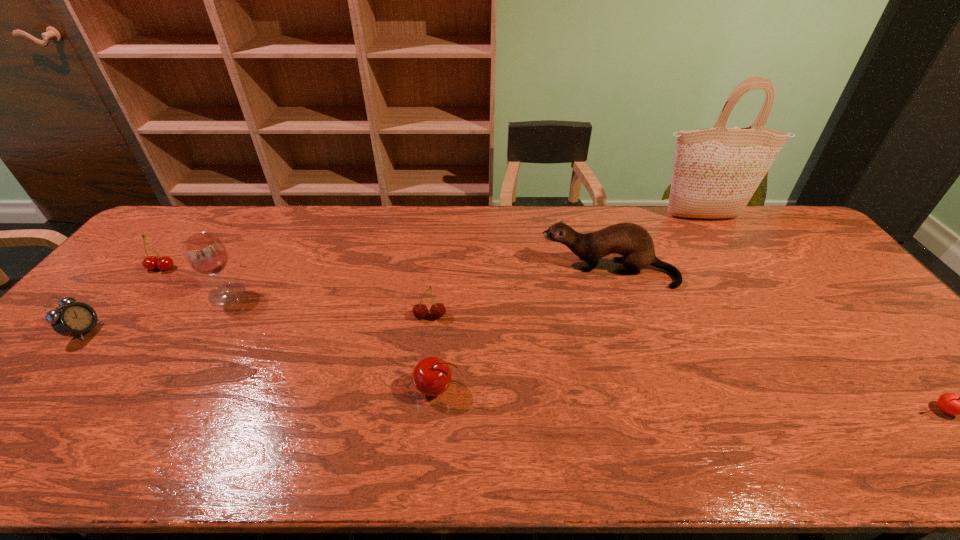
The image size is (960, 540). Identify the location of free space located 0.050m on the left of the third object from left to right. (193, 294).

Where is `vacant area situated at the face of the sixth object from left to right`? vacant area situated at the face of the sixth object from left to right is located at coordinates (463, 271).

Where is `vacant space located at the face of the sixth object from left to right`? The width and height of the screenshot is (960, 540). vacant space located at the face of the sixth object from left to right is located at coordinates (433, 271).

At what (x,y) coordinates should I click in order to perform the action: click on free space located 0.060m at the face of the sixth object from left to right. Please return your answer as a coordinate pair (x, y). This screenshot has height=540, width=960. Looking at the image, I should click on coord(521,271).

Where is `vacant region located 0.100m with the stems of the farthest cherry pointing upwards`? The image size is (960, 540). vacant region located 0.100m with the stems of the farthest cherry pointing upwards is located at coordinates (138, 296).

Locate an element on the screen. The height and width of the screenshot is (540, 960). vacant area situated 0.230m on the surface of the second farthest cherry is located at coordinates (420, 396).

Locate an element on the screen. The width and height of the screenshot is (960, 540). free space located on the face of the alarm clock is located at coordinates (180, 331).

You are a GUI agent. You are given a task and a screenshot of the screen. Output one action in this format:
    pyautogui.click(x=<x>, y=<y>)
    Task: Click on the object positioned at the far edge
    The height and width of the screenshot is (540, 960).
    Given the screenshot: What is the action you would take?
    pyautogui.click(x=716, y=171)

This screenshot has height=540, width=960. Find the location of `cherry that is positioned at the left edge`. cherry that is positioned at the left edge is located at coordinates coord(164,263).

Find the location of a particular element. This screenshot has height=540, width=960. alarm clock present at the left edge is located at coordinates (75, 318).